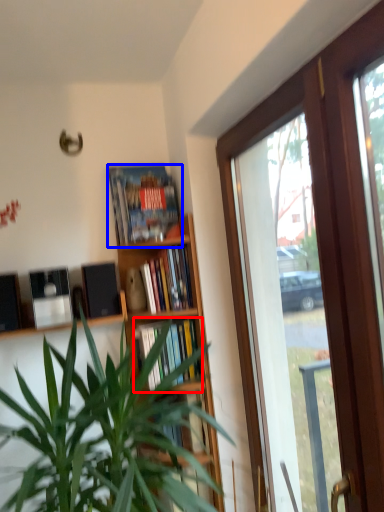
Question: Which object appears farthest to the camera in this image, book (highlighted by a red box) or book (highlighted by a blue box)?

Choices:
 (A) book
 (B) book

Answer: (A)